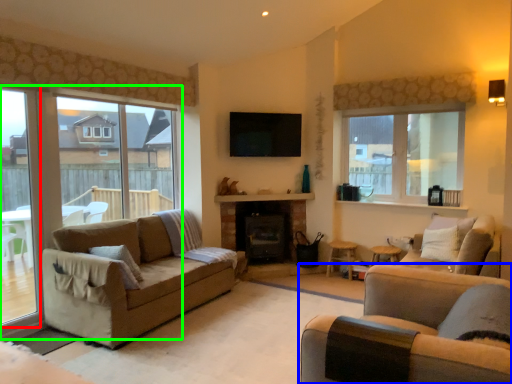
Question: Which object is positioned farthest from window frame (highlighted by a red box)? Select from studio couch (highlighted by a blue box) and window (highlighted by a green box).

Choices:
 (A) studio couch
 (B) window

Answer: (A)